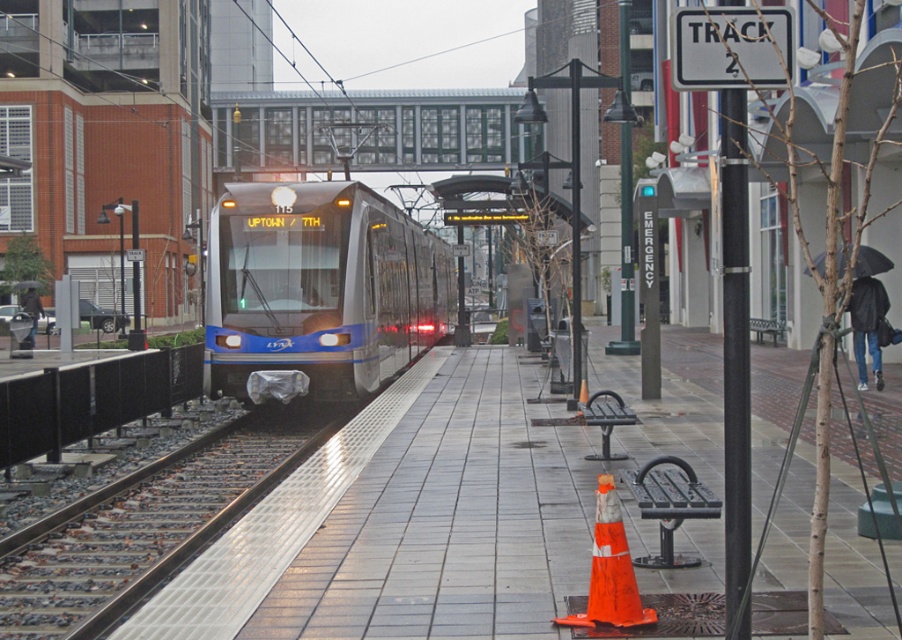
You are a maintenance worker who needs to place the orange matte traffic cone at lower center on top of the silver metallic train at center. Is the traffic cone stable there?

The silver metallic train at center is much taller than the orange matte traffic cone at lower center. Since the train is significantly taller, placing the cone on top might be unstable due to height difference and lack of a flat surface. The cone could easily fall off.